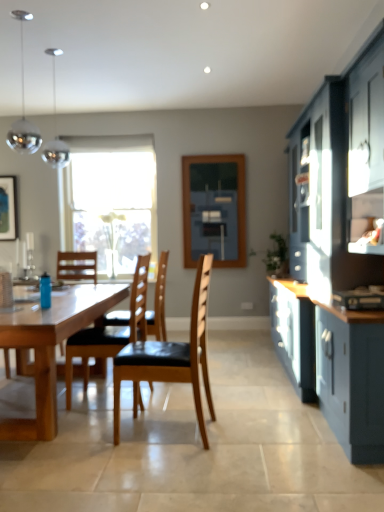
Identify the location of vacant space in front of brown leather chair at center, positioned as the 3th chair in back-to-front order. The height and width of the screenshot is (512, 384). (160, 465).